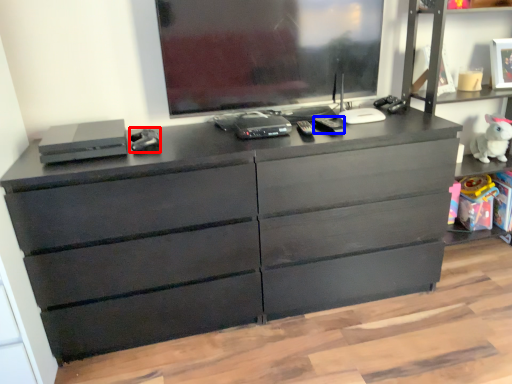
Question: Which object is further to the camera taking this photo, equipment (highlighted by a red box) or equipment (highlighted by a blue box)?

Choices:
 (A) equipment
 (B) equipment

Answer: (B)